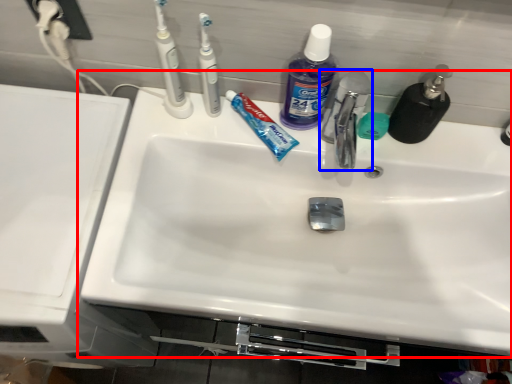
Question: Which object appears farthest to the camera in this image, sink (highlighted by a red box) or tap (highlighted by a blue box)?

Choices:
 (A) sink
 (B) tap

Answer: (A)